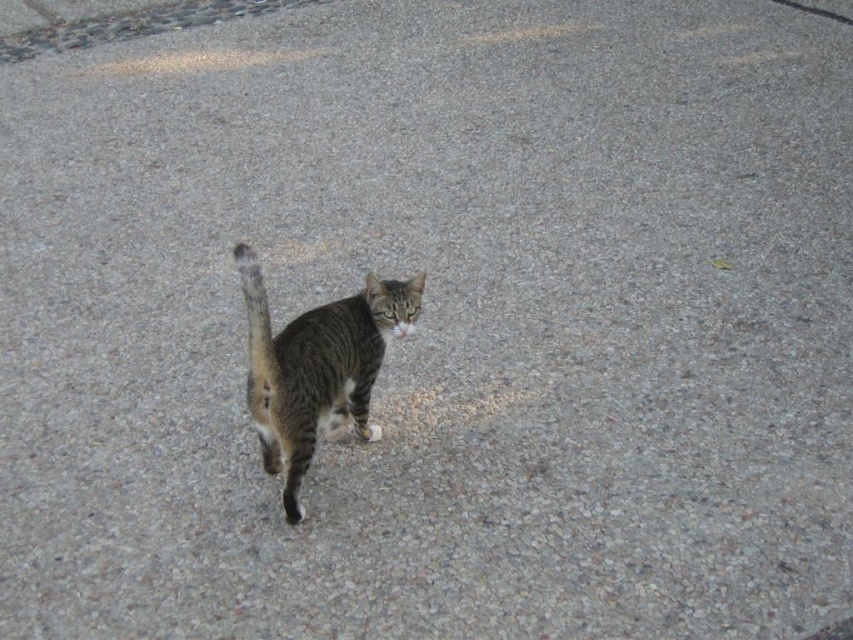
Question: Does striped fur cat at center lie behind striped fur tail at center?

Choices:
 (A) yes
 (B) no

Answer: (A)

Question: Is striped fur cat at center closer to the viewer compared to striped fur tail at center?

Choices:
 (A) no
 (B) yes

Answer: (A)

Question: Does striped fur cat at center come in front of striped fur tail at center?

Choices:
 (A) yes
 (B) no

Answer: (B)